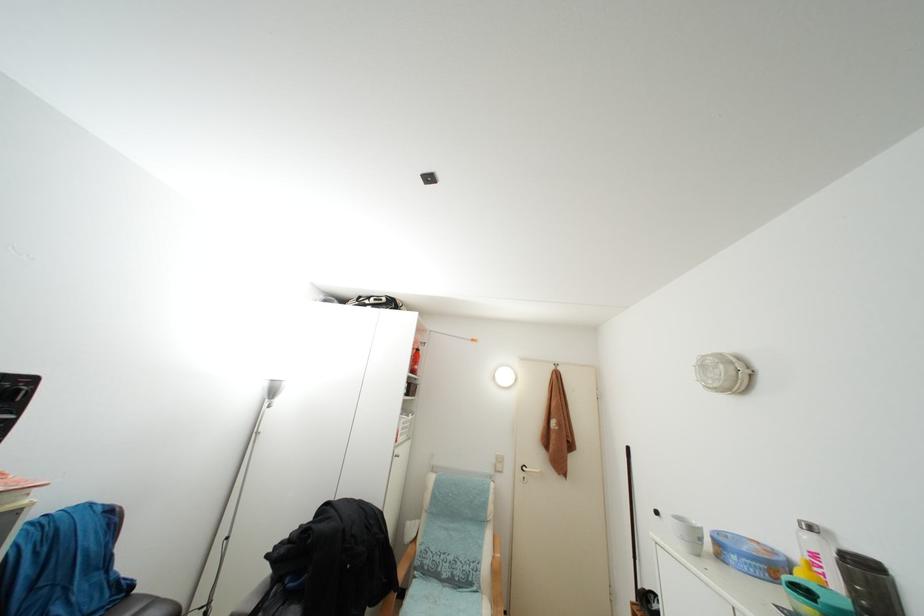
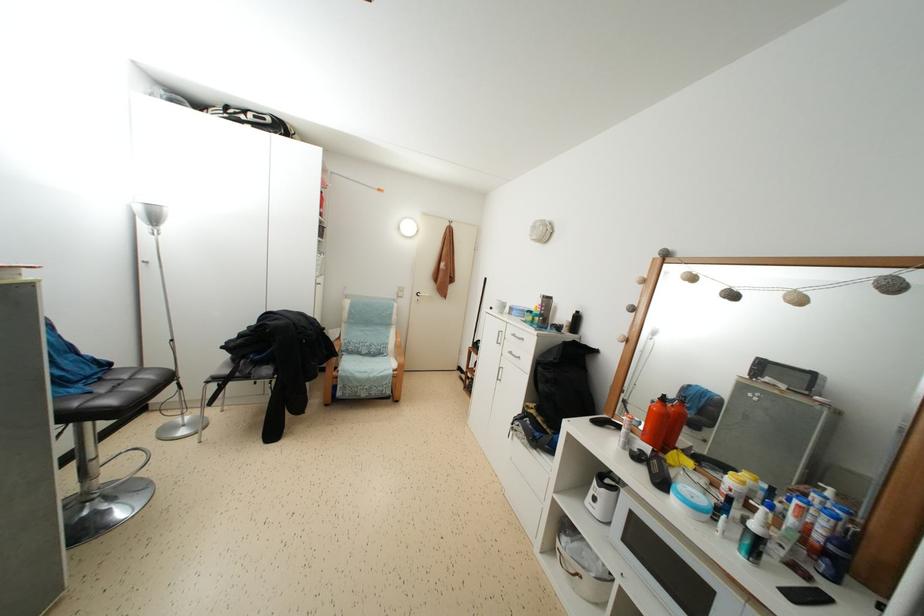
Locate, in the second image, the point that corresponds to point (382, 508) in the first image.

(313, 320)